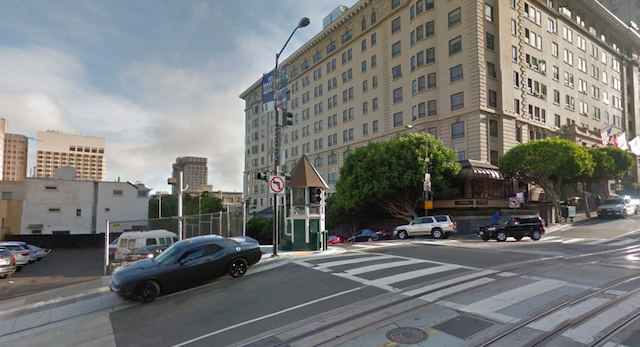
This screenshot has width=640, height=347. I want to click on windows, so click(454, 97), click(454, 75), click(454, 48), click(454, 16), click(457, 130), click(491, 129), click(490, 100), click(489, 72), click(491, 42), click(486, 11).